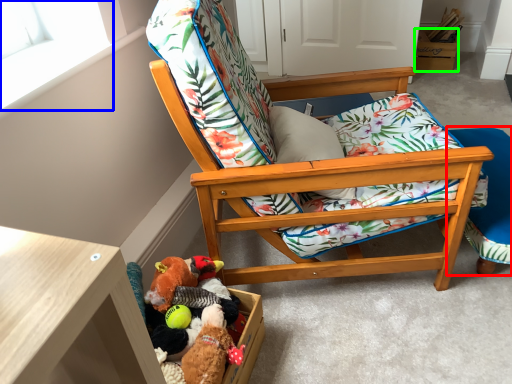
Question: Based on their relative distances, which object is farther from folding chair (highlighted by a red box)? Choose from window screen (highlighted by a blue box) and storage box (highlighted by a green box).

Choices:
 (A) window screen
 (B) storage box

Answer: (B)